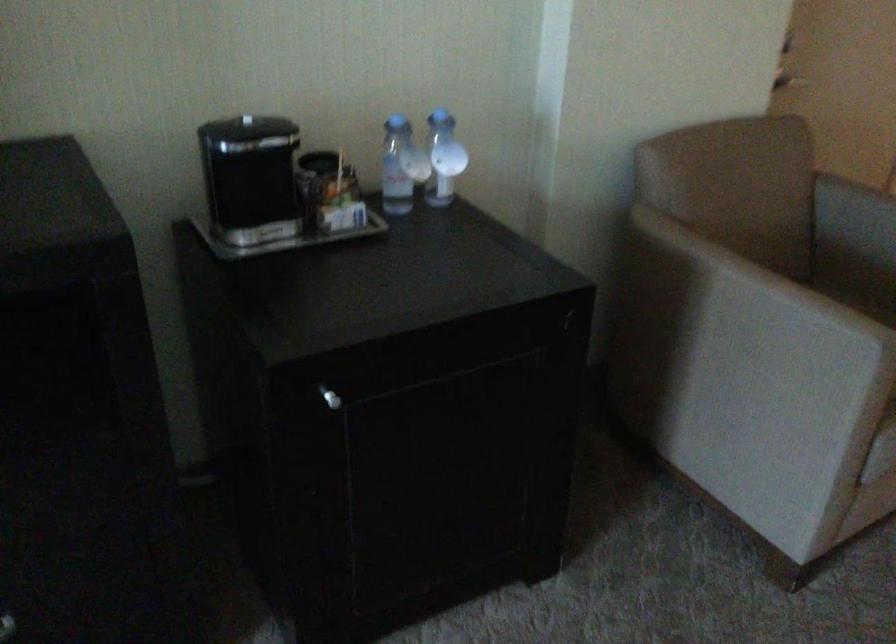
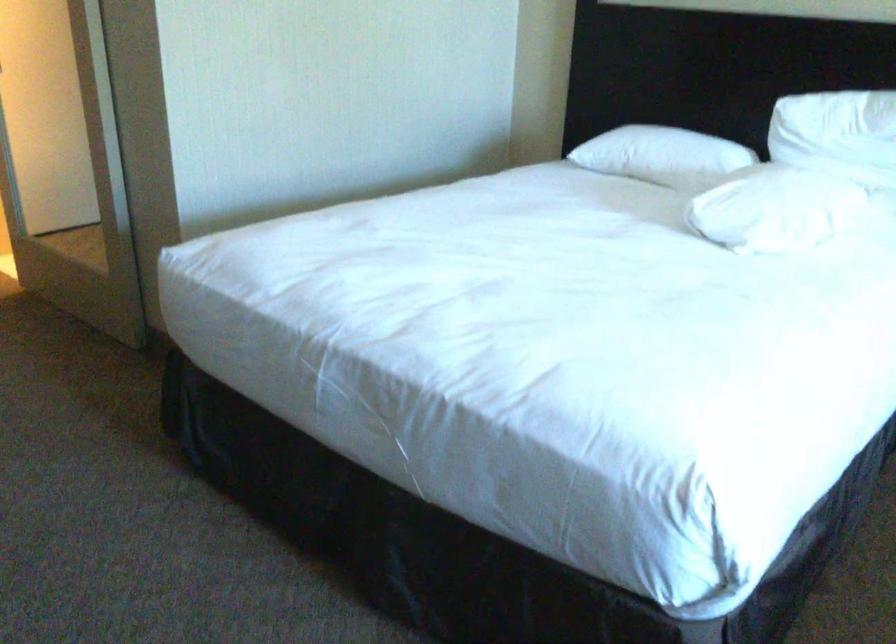
Based on the continuous images, in which direction is the camera rotating?

The rotation direction of the camera is right-down.